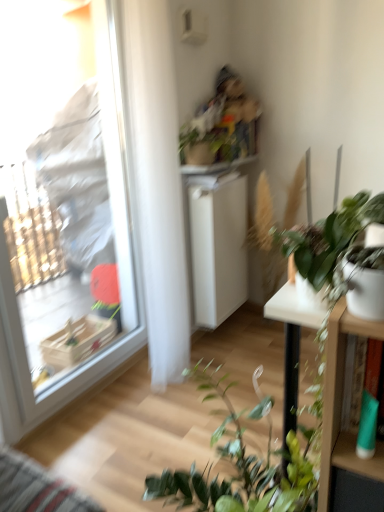
Question: Is white matte cabinet at center to the left or to the right of transparent plastic window at left in the image?

Choices:
 (A) left
 (B) right

Answer: (B)

Question: Looking at their shapes, would you say white matte cabinet at center is wider or thinner than transparent plastic window at left?

Choices:
 (A) wide
 (B) thin

Answer: (A)

Question: Based on their relative distances, which object is nearer to the white matte cabinet at center?

Choices:
 (A) green matte plant at upper center, which is the second houseplant from bottom to top
 (B) transparent plastic window at left
 (C) white glossy table at right
 (D) green matte plant at right, the 1th houseplant positioned from the front

Answer: (A)

Question: Which object is positioned farthest from the green matte plant at right, which is the first houseplant from bottom to top?

Choices:
 (A) transparent plastic window at left
 (B) white matte cabinet at center
 (C) white glossy table at right
 (D) green matte plant at upper center, the 2th houseplant viewed from the front

Answer: (A)